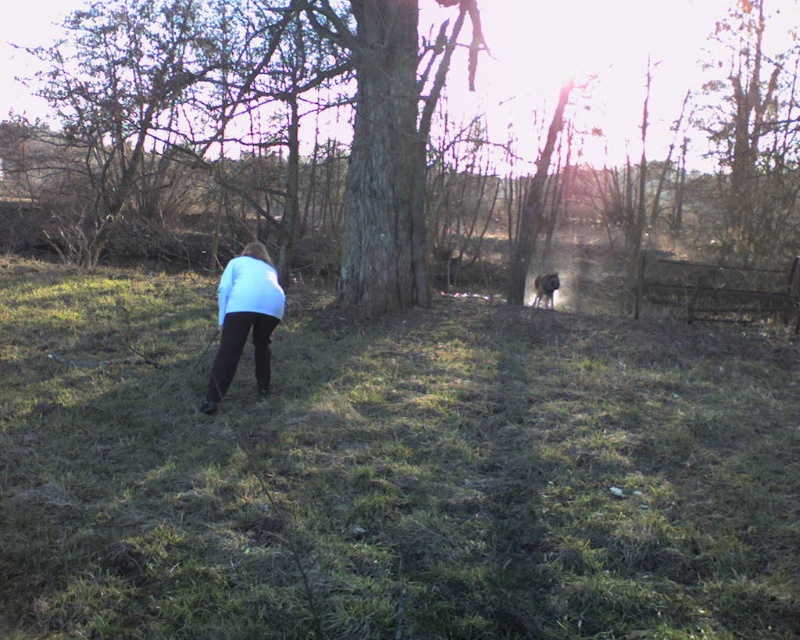
Question: Does rough bark tree at center have a greater width compared to brown fur dog at center?

Choices:
 (A) no
 (B) yes

Answer: (B)

Question: Which of the following is the closest to the observer?

Choices:
 (A) (582, 88)
 (B) (548, 273)
 (C) (229, 300)

Answer: (C)

Question: Can you confirm if green grassy at center is positioned above brown fur dog at center?

Choices:
 (A) yes
 (B) no

Answer: (B)

Question: Estimate the real-world distances between objects in this image. Which object is closer to the rough bark tree at center?

Choices:
 (A) light blue fabric at center
 (B) brown fur dog at center
 (C) green grassy at center

Answer: (C)

Question: Estimate the real-world distances between objects in this image. Which object is farther from the light blue fabric at center?

Choices:
 (A) rough bark tree at center
 (B) brown fur dog at center

Answer: (A)

Question: Can you confirm if light blue fabric at center is positioned above brown fur dog at center?

Choices:
 (A) no
 (B) yes

Answer: (A)